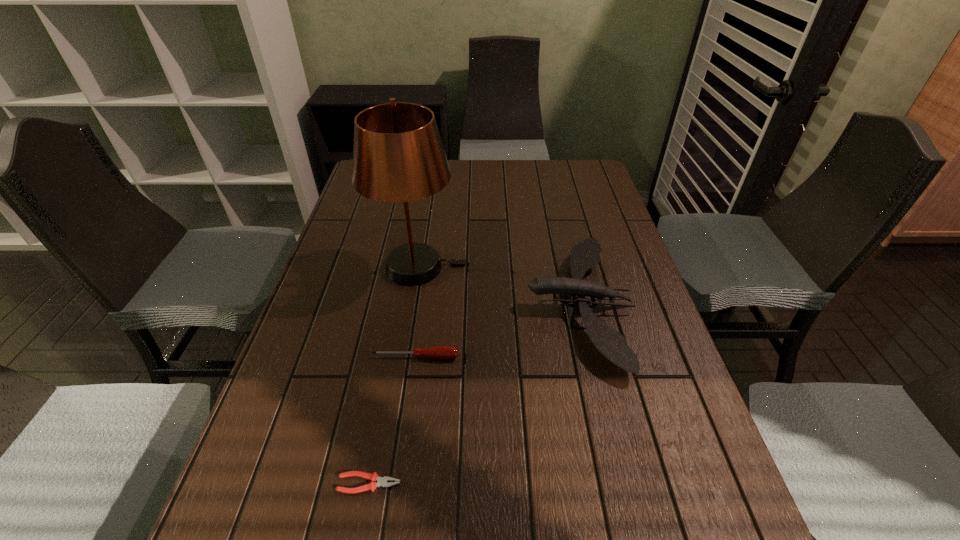
At what (x,y) coordinates should I click in order to perform the action: click on vacant area that lies between the screwdriver and the second tallest object. Please return your answer as a coordinate pair (x, y). Looking at the image, I should click on (497, 331).

You are a GUI agent. You are given a task and a screenshot of the screen. Output one action in this format:
    pyautogui.click(x=<x>, y=<y>)
    Task: Click on the free space between the tallest object and the rightmost object
    The height and width of the screenshot is (540, 960).
    Given the screenshot: What is the action you would take?
    pyautogui.click(x=498, y=286)

You are a GUI agent. You are given a task and a screenshot of the screen. Output one action in this format:
    pyautogui.click(x=<x>, y=<y>)
    Task: Click on the free point between the screwdriver and the pliers
    The width and height of the screenshot is (960, 540).
    Given the screenshot: What is the action you would take?
    pyautogui.click(x=393, y=420)

Where is `vacant region between the third tallest object and the lampshade`? vacant region between the third tallest object and the lampshade is located at coordinates (417, 312).

Locate an element on the screen. Image resolution: width=960 pixels, height=540 pixels. free space between the rightmost object and the second shortest object is located at coordinates (497, 331).

The height and width of the screenshot is (540, 960). Find the location of `unoccupied area between the tallest object and the third shortest object`. unoccupied area between the tallest object and the third shortest object is located at coordinates (498, 286).

At what (x,y) coordinates should I click in order to perform the action: click on free area in between the third tallest object and the pliers. Please return your answer as a coordinate pair (x, y). Looking at the image, I should click on (393, 420).

Locate an element on the screen. The width and height of the screenshot is (960, 540). object that is the third closest to the lampshade is located at coordinates (382, 481).

Locate an element on the screen. The image size is (960, 540). the closest object to the drone is located at coordinates (398, 156).

Locate an element on the screen. This screenshot has height=540, width=960. free location that satisfies the following two spatial constraints: 1. on the front-facing side of the tallest object; 2. on the right side of the screwdriver is located at coordinates (404, 357).